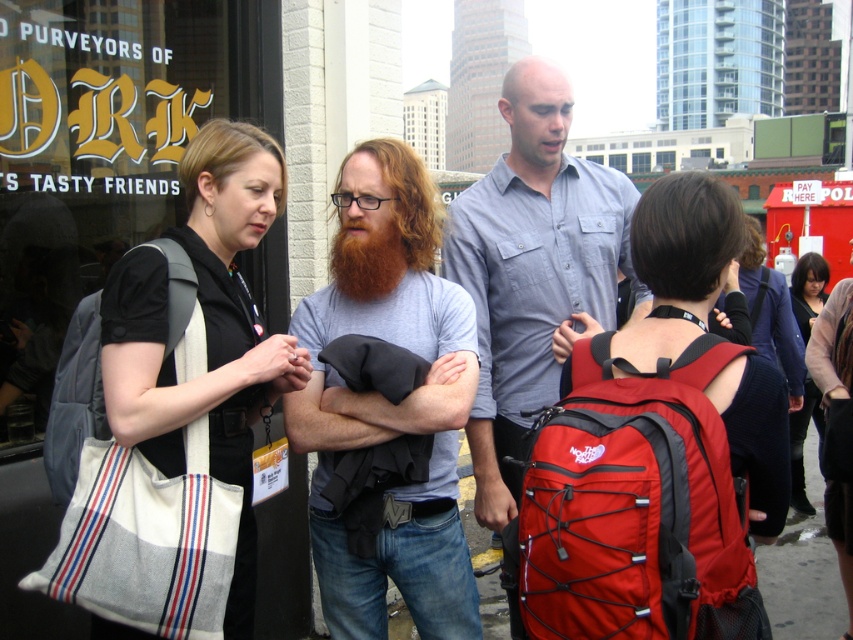
Who is positioned more to the left, gray cotton t-shirt at center or matte gray shirt at center?

Positioned to the left is gray cotton t-shirt at center.

Is point (364, 234) in front of point (485, 282)?

Yes, point (364, 234) is in front of point (485, 282).

Which is in front, point (323, 568) or point (544, 332)?

Positioned in front is point (323, 568).

This screenshot has width=853, height=640. What are the coordinates of `gray cotton t-shirt at center` in the screenshot? It's located at (387, 406).

Does point (450, 237) lie in front of point (335, 285)?

No, it is behind (335, 285).

What do you see at coordinates (532, 269) in the screenshot?
I see `matte gray shirt at center` at bounding box center [532, 269].

At what (x,y) coordinates should I click in order to perform the action: click on matte gray shirt at center. Please return your answer as a coordinate pair (x, y). This screenshot has width=853, height=640. Looking at the image, I should click on (532, 269).

Who is shorter, gray cotton t-shirt at center or red fabric backpack at center?

With less height is red fabric backpack at center.

The image size is (853, 640). What do you see at coordinates (387, 406) in the screenshot? I see `gray cotton t-shirt at center` at bounding box center [387, 406].

This screenshot has width=853, height=640. What are the coordinates of `gray cotton t-shirt at center` in the screenshot? It's located at (387, 406).